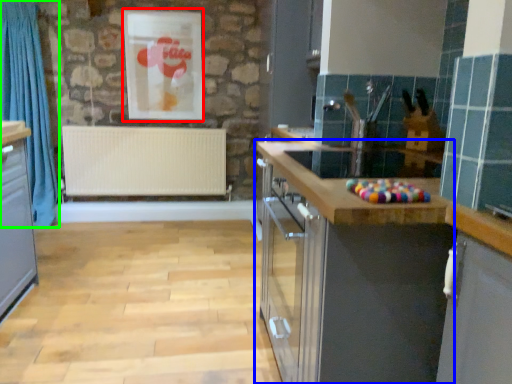
Question: Based on their relative distances, which object is nearer to picture frame (highlighted by a red box)? Choose from cabinetry (highlighted by a blue box) and curtain (highlighted by a green box).

Choices:
 (A) cabinetry
 (B) curtain

Answer: (B)